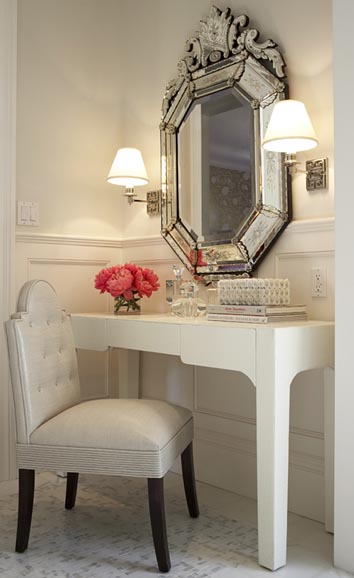
Where is `desk`? The height and width of the screenshot is (578, 354). desk is located at coordinates (266, 348).